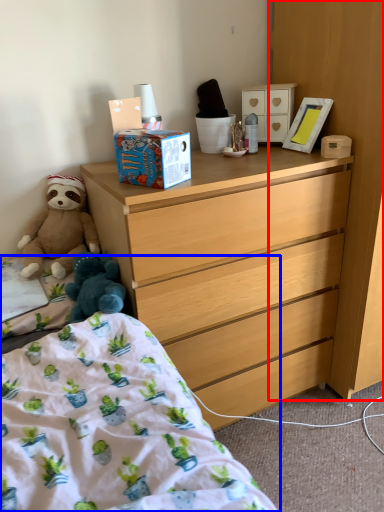
Question: Which object appears closest to the camera in this image, cabinetry (highlighted by a red box) or bed (highlighted by a blue box)?

Choices:
 (A) cabinetry
 (B) bed

Answer: (B)